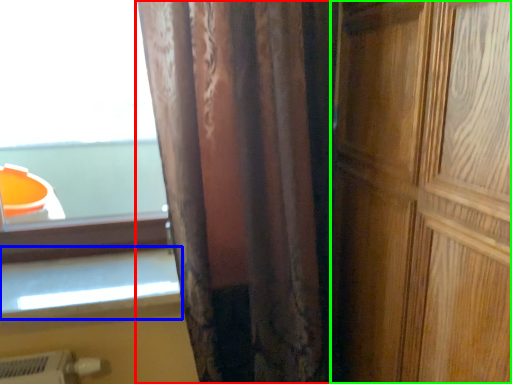
Question: Based on their relative distances, which object is nearer to curtain (highlighted by a red box)? Choose from window sill (highlighted by a blue box) and door (highlighted by a green box).

Choices:
 (A) window sill
 (B) door

Answer: (B)